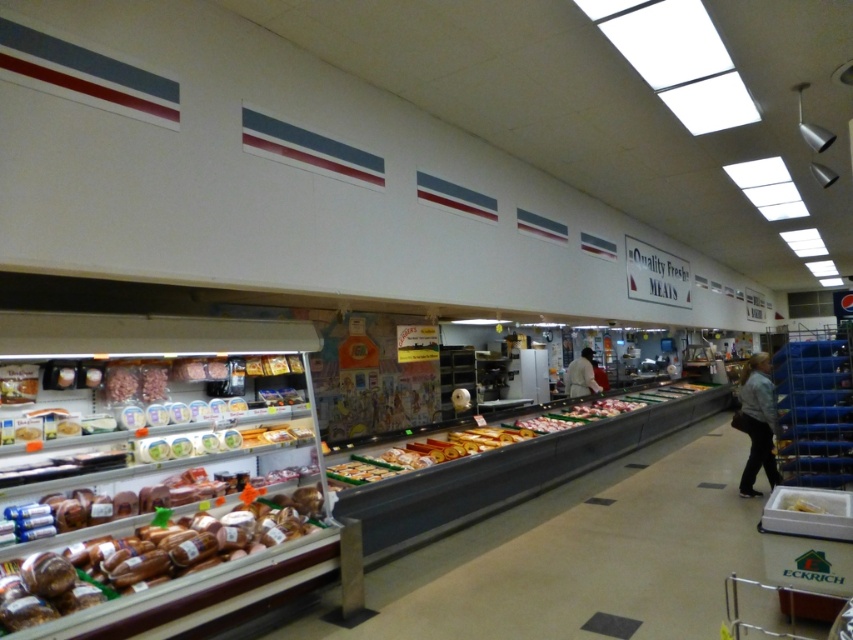
You are a grocery store employee who needs to place a new sign between the brown glossy bread at lower left and the yellow matte cheese at center. The sign is 1.5 meters long. Can you fit it between them without moving either item?

The distance between the brown glossy bread at lower left and the yellow matte cheese at center is 3.35 meters. Since the sign is only 1.5 meters long, there is enough space to place it between them without moving either item.

You are a customer in the grocery store and want to pick up both the white matte coat at center and the yellow matte cheese at center. Which one is closer to you?

The white matte coat at center is closer to you than the yellow matte cheese at center, so you can reach it first.